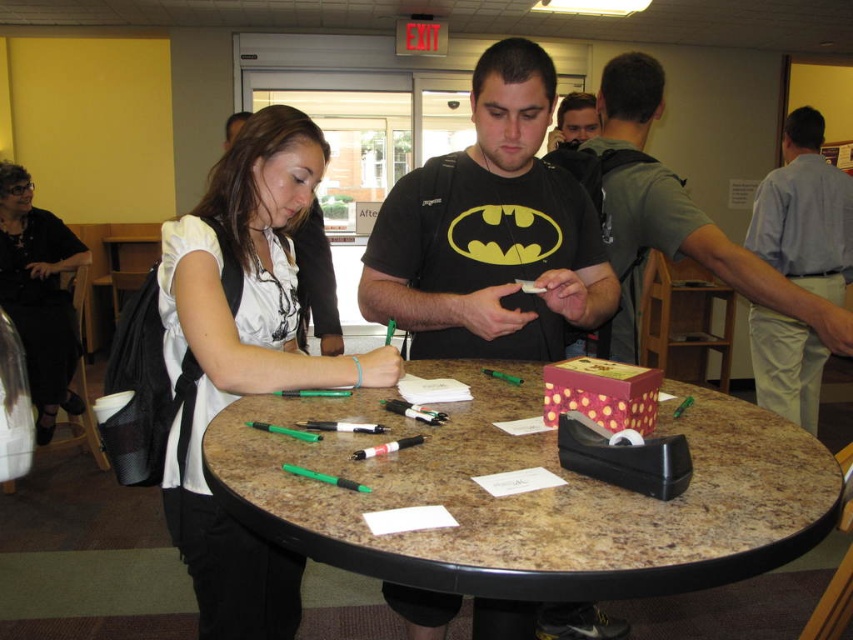
Image resolution: width=853 pixels, height=640 pixels. What do you see at coordinates (804, 212) in the screenshot?
I see `light blue shirt at right` at bounding box center [804, 212].

This screenshot has width=853, height=640. What do you see at coordinates (804, 212) in the screenshot?
I see `light blue shirt at right` at bounding box center [804, 212].

Find the location of a particular element. light blue shirt at right is located at coordinates (804, 212).

Does white matte shirt at center appear on the right side of matte black shirt at center?

In fact, white matte shirt at center is to the left of matte black shirt at center.

Who is higher up, white matte shirt at center or matte black shirt at center?

matte black shirt at center is above.

Which is in front, point (299, 371) or point (567, 116)?

Positioned in front is point (299, 371).

Identify the location of white matte shirt at center. The width and height of the screenshot is (853, 640). (242, 358).

Does white matte shirt at center appear on the right side of black fabric dress at upper left?

Yes, white matte shirt at center is to the right of black fabric dress at upper left.

Does white matte shirt at center have a smaller size compared to black fabric dress at upper left?

No, white matte shirt at center is not smaller than black fabric dress at upper left.

Where is `white matte shirt at center`? This screenshot has height=640, width=853. white matte shirt at center is located at coordinates (242, 358).